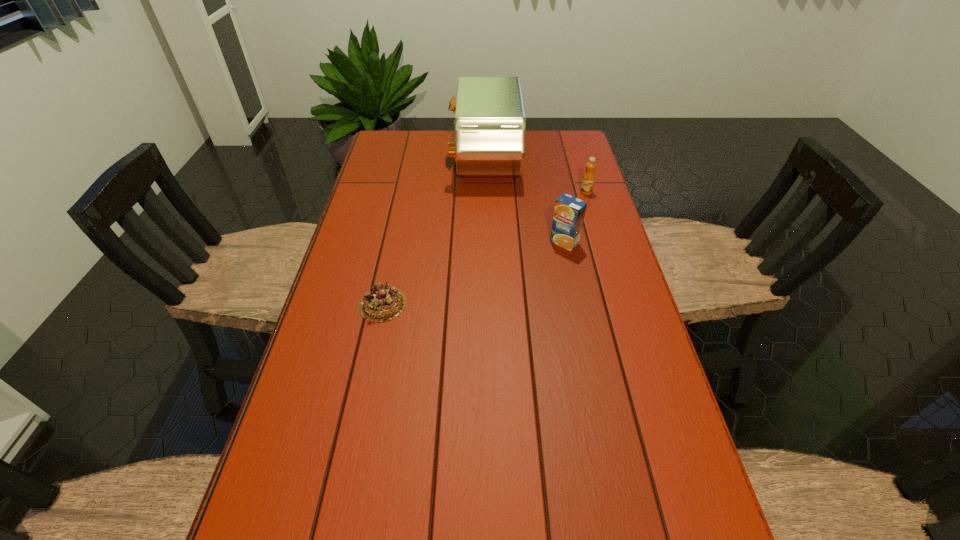
Identify the location of the tallest object. (490, 123).

Image resolution: width=960 pixels, height=540 pixels. In order to click on toaster oven in this screenshot , I will do `click(490, 123)`.

Identify the location of the nearer orange juice. (569, 212).

Image resolution: width=960 pixels, height=540 pixels. In order to click on the third farthest object in this screenshot , I will do `click(569, 212)`.

Identify the location of the farther orange juice. (588, 179).

The image size is (960, 540). What are the coordinates of `the rightmost object` in the screenshot? It's located at (588, 179).

This screenshot has height=540, width=960. In order to click on the leftmost object in this screenshot , I will do `click(381, 303)`.

Where is `the shortest object`? This screenshot has width=960, height=540. the shortest object is located at coordinates (381, 303).

This screenshot has height=540, width=960. What are the coordinates of `vacant space located 0.250m on the door side of the third object from right to left` in the screenshot? It's located at [x=380, y=160].

Find the location of a particular element. This screenshot has height=540, width=960. blank space located on the left of the left orange juice is located at coordinates (529, 242).